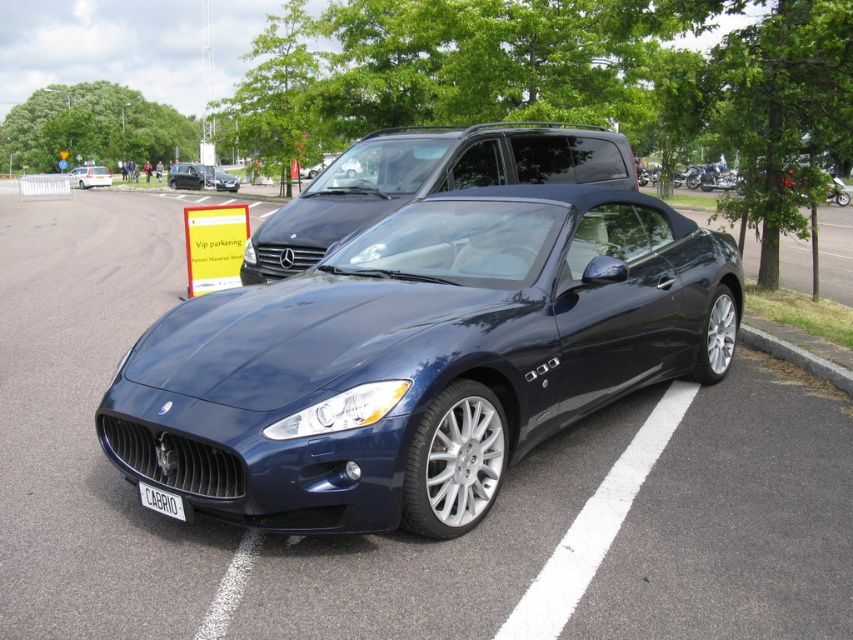
Does point (523, 376) lie behind point (173, 179)?

No, it is in front of (173, 179).

What do you see at coordinates (421, 358) in the screenshot? I see `glossy metallic car at center` at bounding box center [421, 358].

Where is `glossy metallic car at center`? This screenshot has width=853, height=640. glossy metallic car at center is located at coordinates (421, 358).

Is gray concrete curb at lower right bigger than matte black car at center?

No.

Measure the distance between point (x=843, y=388) and camera.

Point (x=843, y=388) and camera are 6.01 meters apart from each other.

Find the location of `gray concrete curb at lower right`. gray concrete curb at lower right is located at coordinates (798, 356).

Can you confirm if glossy black car at center is positioned below gray concrete curb at lower right?

Actually, glossy black car at center is above gray concrete curb at lower right.

Which is more to the left, glossy black car at center or gray concrete curb at lower right?

Positioned to the left is glossy black car at center.

You are a GUI agent. You are given a task and a screenshot of the screen. Output one action in this format:
    pyautogui.click(x=<x>, y=<y>)
    Task: Click on the glossy black car at center
    
    Given the screenshot: What is the action you would take?
    pyautogui.click(x=426, y=180)